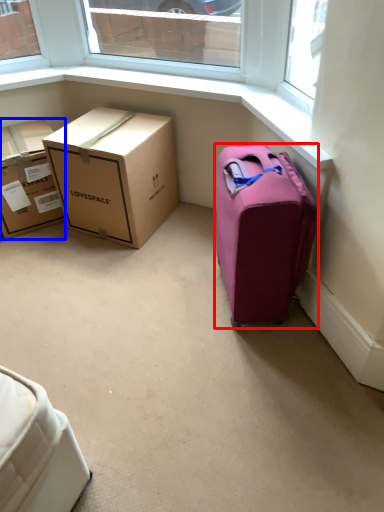
Question: Which object is closer to the camera taking this photo, suitcase (highlighted by a red box) or box (highlighted by a blue box)?

Choices:
 (A) suitcase
 (B) box

Answer: (A)